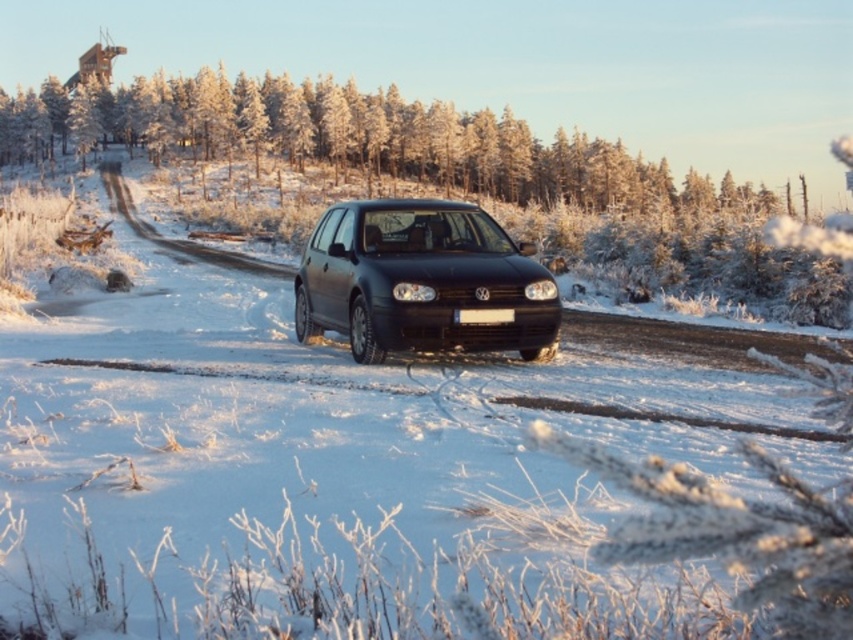
You are a photographer trying to capture the matte black car at center and the white plastic license plate at center in a single frame. Given that the license plate must remain clearly visible, would you recommend using a wide angle lens or a telephoto lens?

The matte black car at center is larger than the white plastic license plate at center. To ensure the license plate remains clearly visible while capturing both objects, a wide angle lens would be more suitable as it can capture more of the scene and maintain detail in smaller elements like the license plate.

You are a photographer trying to capture the black Volkswagen car on the snow road. You notice two points marked in the scene, point at position [433,202] and point at position [469,317]. Which point is closer to your camera lens?

Point at position [433,202] is further to the camera than point at position [469,317], so the point at position [469,317] is closer to the camera lens.